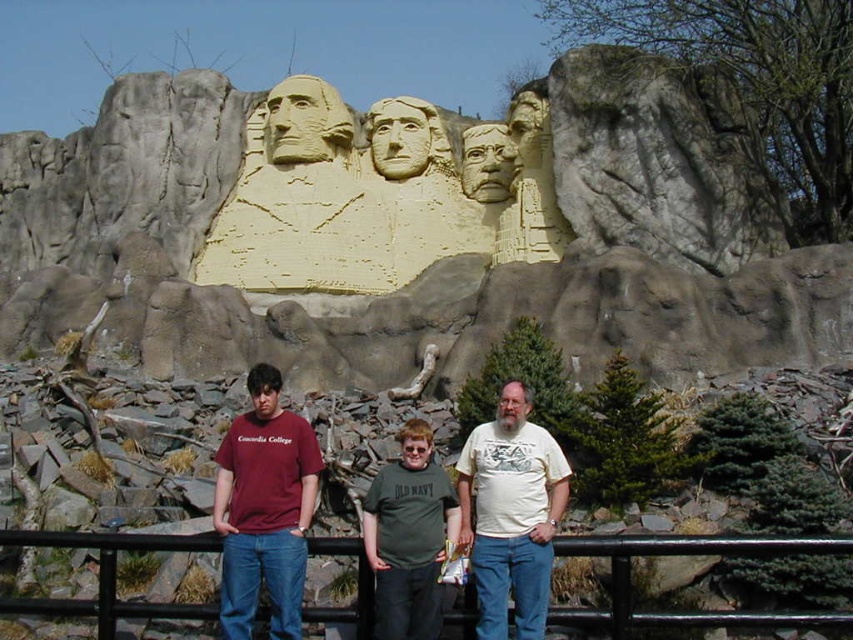
Question: Is maroon t-shirt at center above green cotton shirt at center?

Choices:
 (A) no
 (B) yes

Answer: (B)

Question: Estimate the real-world distances between objects in this image. Which object is closer to the yellow sand sculpture at center?

Choices:
 (A) maroon t-shirt at center
 (B) green cotton shirt at center
 (C) white matte t-shirt at center

Answer: (A)

Question: Which of the following is the closest to the observer?

Choices:
 (A) black metal/rail at lower center
 (B) green cotton shirt at center
 (C) maroon t-shirt at center
 (D) white matte t-shirt at center

Answer: (A)

Question: Considering the relative positions of yellow sand sculpture at center and green cotton shirt at center in the image provided, where is yellow sand sculpture at center located with respect to green cotton shirt at center?

Choices:
 (A) right
 (B) left

Answer: (B)

Question: Observing the image, what is the correct spatial positioning of white matte t-shirt at center in reference to green cotton shirt at center?

Choices:
 (A) right
 (B) left

Answer: (A)

Question: Which point is farther to the camera?

Choices:
 (A) white matte t-shirt at center
 (B) black metal/rail at lower center
 (C) yellow sand sculpture at center
 (D) maroon t-shirt at center

Answer: (C)